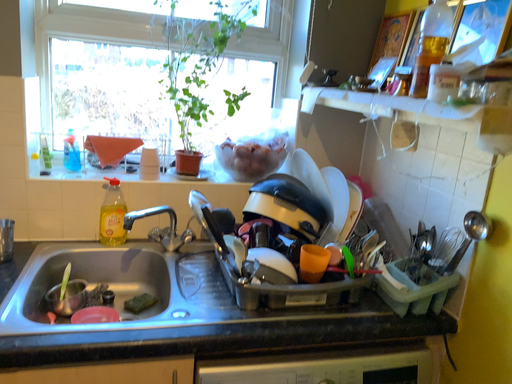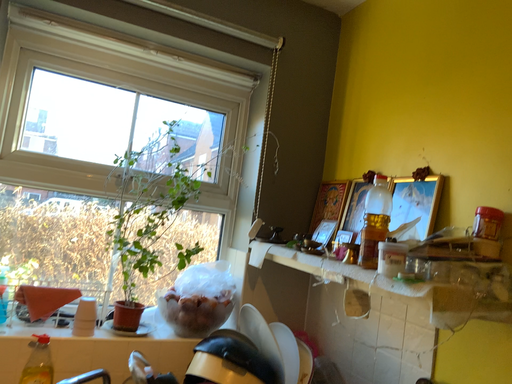
Question: How did the camera likely rotate when shooting the video?

Choices:
 (A) rotated left
 (B) rotated right

Answer: (B)